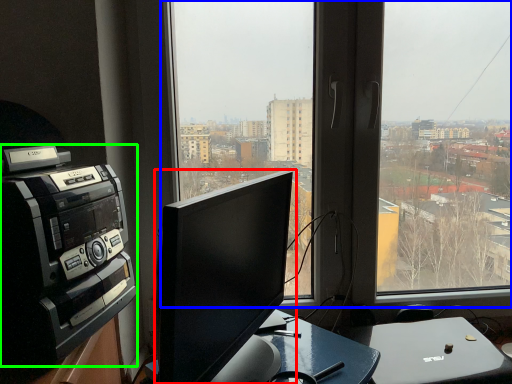
Question: Which object is the closest to the computer monitor (highlighted by a red box)? Choose among these: window (highlighted by a blue box) or amplifier (highlighted by a green box).

Choices:
 (A) window
 (B) amplifier

Answer: (B)